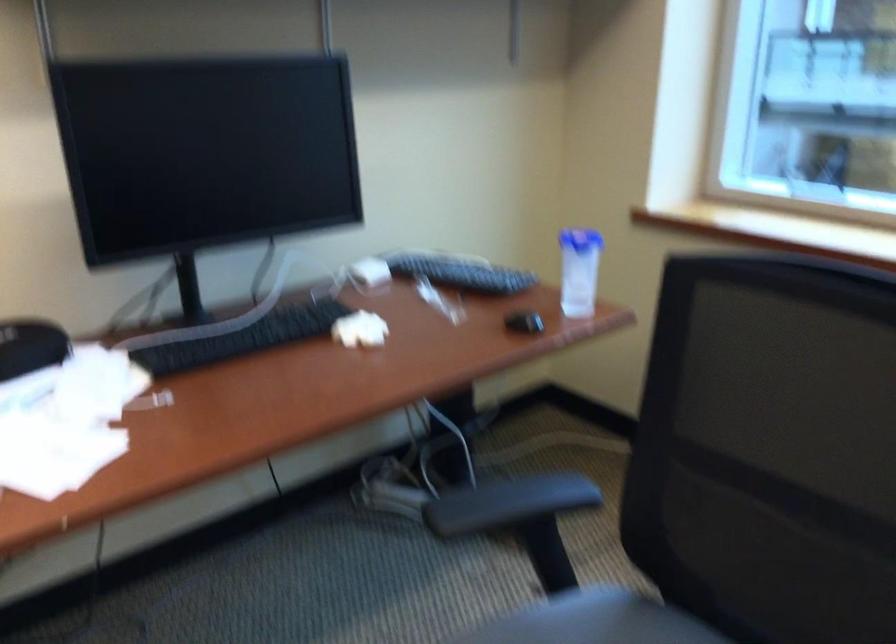
Where would you push the black chair armrest? Please return your answer as a coordinate pair (x, y).

(507, 503)